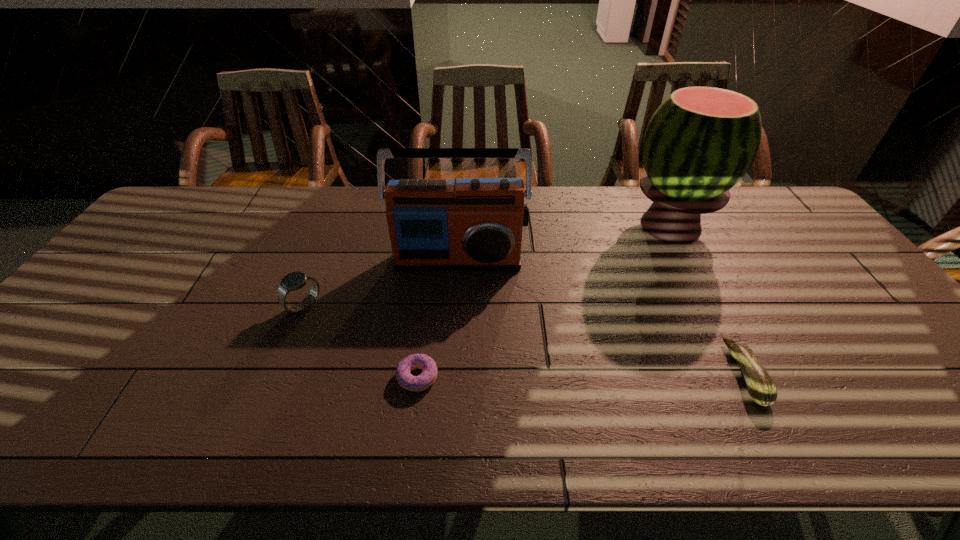
Where is `blank space at the near right corner of the desktop`? This screenshot has width=960, height=540. blank space at the near right corner of the desktop is located at coordinates (929, 430).

At what (x,y) coordinates should I click in order to perform the action: click on empty space that is in between the third tallest object and the radio receiver. Please return your answer as a coordinate pair (x, y). Image resolution: width=960 pixels, height=540 pixels. Looking at the image, I should click on 381,282.

This screenshot has width=960, height=540. Identify the location of vacant area that lies between the radio receiver and the watermelon. (564, 242).

You are a GUI agent. You are given a task and a screenshot of the screen. Output one action in this format:
    pyautogui.click(x=<x>, y=<y>)
    Task: Click on the empty space between the doughnut and the fourth tallest object
    This screenshot has height=540, width=960.
    Given the screenshot: What is the action you would take?
    pyautogui.click(x=582, y=375)

Identify the location of vacant area that lies between the zucchini and the tallest object. (708, 300).

Locate an element on the screen. This screenshot has height=540, width=960. free spot between the zucchini and the tallest object is located at coordinates (708, 300).

Image resolution: width=960 pixels, height=540 pixels. I want to click on free space between the second tallest object and the watermelon, so click(564, 242).

This screenshot has height=540, width=960. What are the coordinates of `vacant area that lies between the leftmost object and the doughnut` in the screenshot? It's located at (361, 341).

Identify the location of empty space that is in between the shortest object and the watermelon. The image size is (960, 540). (543, 301).

The height and width of the screenshot is (540, 960). In order to click on vacant space that is in between the doughnut and the second tallest object in this screenshot , I will do `click(438, 318)`.